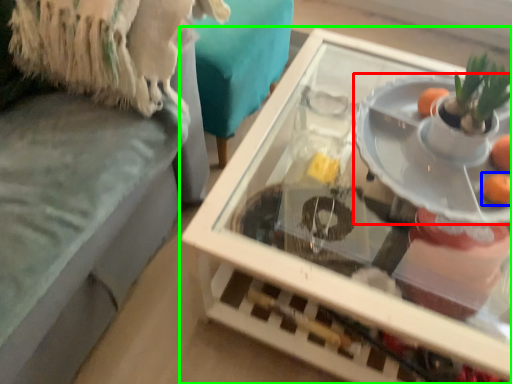
Question: Which object is positioned farthest from plate (highlighted by a red box)? Select from orange (highlighted by a blue box) and table (highlighted by a green box).

Choices:
 (A) orange
 (B) table

Answer: (B)